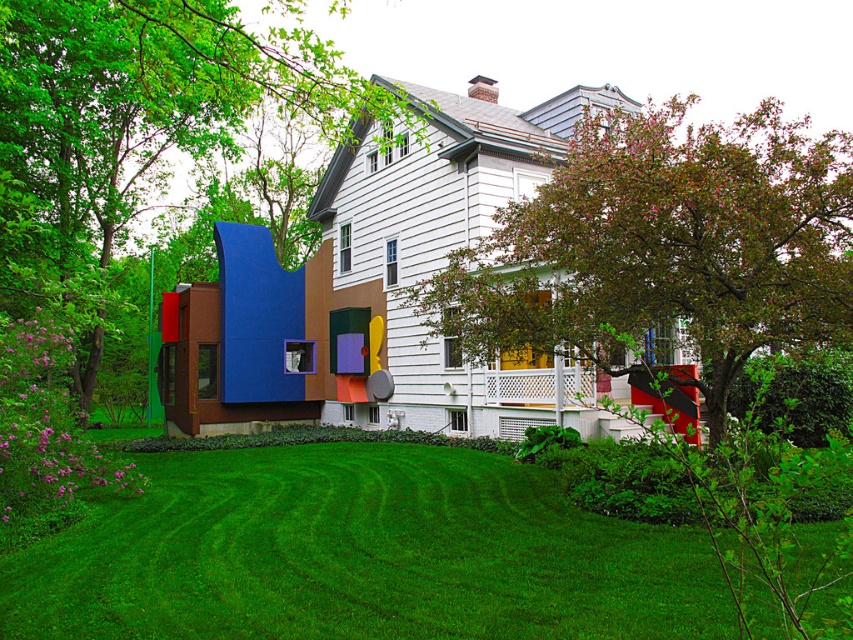
Question: Which point is closer to the camera?

Choices:
 (A) (403, 493)
 (B) (698, 148)

Answer: (B)

Question: Does green grass at lower center appear on the right side of smooth bark tree at center?

Choices:
 (A) no
 (B) yes

Answer: (A)

Question: Which of the following is the farthest from the observer?

Choices:
 (A) green leafy tree at left
 (B) green grass at lower center
 (C) smooth bark tree at center

Answer: (A)

Question: Is green grass at lower center thinner than smooth bark tree at center?

Choices:
 (A) yes
 (B) no

Answer: (A)

Question: Is smooth bark tree at center positioned in front of green leafy tree at left?

Choices:
 (A) yes
 (B) no

Answer: (A)

Question: Which object is closer to the camera taking this photo?

Choices:
 (A) smooth bark tree at center
 (B) green leafy tree at left
 (C) green grass at lower center

Answer: (A)